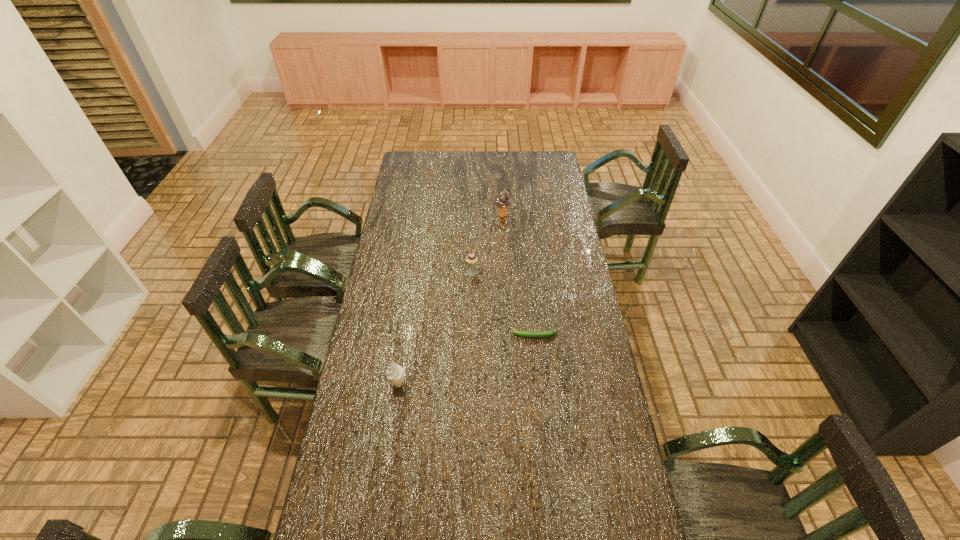
Identify the location of free space located 0.340m on the back of the second icecream from right to left. (473, 219).

The height and width of the screenshot is (540, 960). I want to click on vacant space located 0.270m on the front-facing side of the third farthest object, so click(442, 336).

Find the location of a particular element. Image resolution: width=960 pixels, height=540 pixels. free space located on the front-facing side of the third farthest object is located at coordinates (442, 336).

Where is `vacant space located on the front-facing side of the third farthest object`? The width and height of the screenshot is (960, 540). vacant space located on the front-facing side of the third farthest object is located at coordinates (463, 336).

The width and height of the screenshot is (960, 540). What are the coordinates of `object that is positioned at the left edge` in the screenshot? It's located at (395, 373).

Find the location of a particular element. The image size is (960, 540). object at the right edge is located at coordinates (534, 334).

The image size is (960, 540). I want to click on free spot at the far edge of the desktop, so click(x=502, y=171).

In the image, there is a desktop. Where is `vacant region at the left edge`? This screenshot has width=960, height=540. vacant region at the left edge is located at coordinates (402, 244).

Locate an element on the screen. The height and width of the screenshot is (540, 960). blank space at the right edge is located at coordinates (573, 390).

Where is `vacant area at the far left corner of the desktop`? vacant area at the far left corner of the desktop is located at coordinates (407, 169).